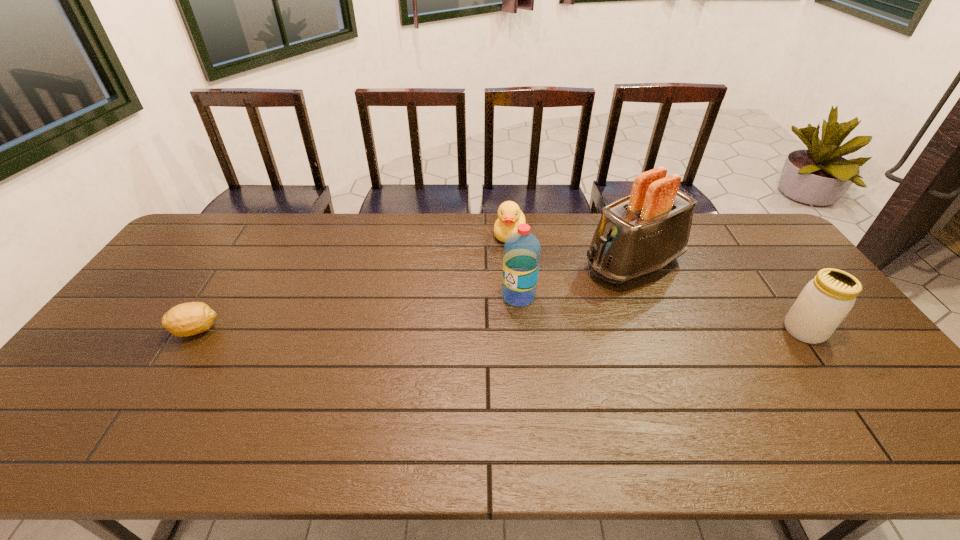
Where is `lemon`? The width and height of the screenshot is (960, 540). lemon is located at coordinates (187, 319).

Find the location of `the leftmost object`. the leftmost object is located at coordinates (187, 319).

I want to click on the rightmost object, so click(x=825, y=301).

This screenshot has height=540, width=960. What are the coordinates of `the third shortest object` in the screenshot? It's located at (825, 301).

This screenshot has width=960, height=540. I want to click on duck, so click(510, 216).

This screenshot has width=960, height=540. I want to click on water bottle, so click(x=521, y=257).

Locate an element on the screen. The height and width of the screenshot is (540, 960). the tallest object is located at coordinates (639, 234).

Image resolution: width=960 pixels, height=540 pixels. I want to click on the second object from right to left, so click(x=639, y=234).

Where is `vacant space located 0.120m at the stem end of the shortest object`? The image size is (960, 540). vacant space located 0.120m at the stem end of the shortest object is located at coordinates (132, 330).

Identify the location of vacant space located 0.120m at the stem end of the shortest object. (132, 330).